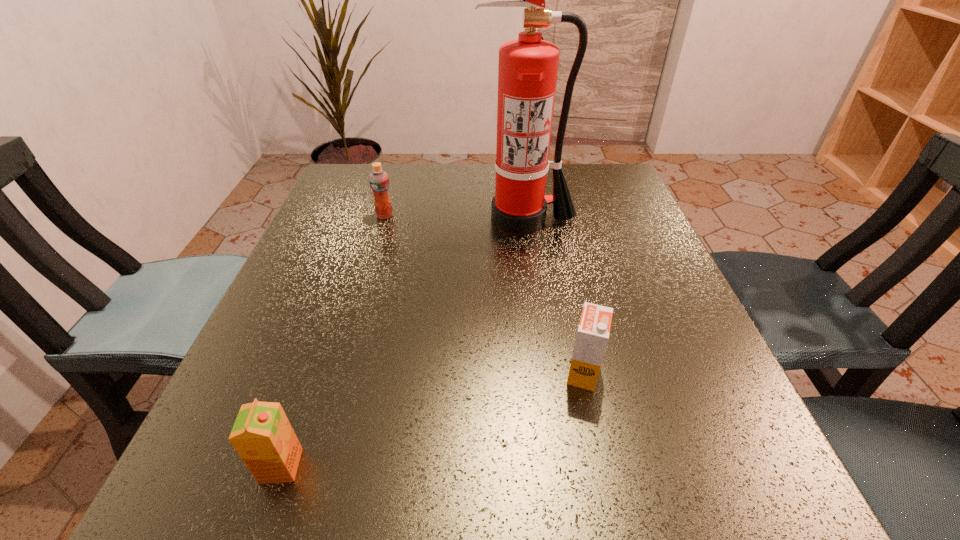
This screenshot has height=540, width=960. Find the location of `fire extinguisher`. fire extinguisher is located at coordinates (527, 71).

The height and width of the screenshot is (540, 960). I want to click on the farthest orange juice, so click(x=379, y=181).

At what (x,y) coordinates should I click in order to perform the action: click on the third farthest object. Please return your answer as a coordinate pair (x, y). The width and height of the screenshot is (960, 540). Looking at the image, I should click on (593, 332).

The width and height of the screenshot is (960, 540). Find the location of `the second nearest orange juice`. the second nearest orange juice is located at coordinates (593, 332).

Where is `the nearest object`? The image size is (960, 540). the nearest object is located at coordinates (262, 435).

Identify the location of vacant space located 0.350m at the nozzle of the fire extinguisher. (541, 367).

At what (x,y) coordinates should I click in order to perform the action: click on vacant point located 0.150m on the front of the farthest orange juice. Please return your answer as a coordinate pair (x, y). This screenshot has width=960, height=540. Looking at the image, I should click on (371, 263).

You are a GUI agent. You are given a task and a screenshot of the screen. Output one action in this format:
    pyautogui.click(x=<x>, y=<y>)
    Task: Click on the vacant region located 0.120m on the right of the second farthest orange juice
    The image size is (960, 540).
    Given the screenshot: What is the action you would take?
    pyautogui.click(x=680, y=373)

Locate an element on the screen. The height and width of the screenshot is (540, 960). vacant space located 0.060m on the right of the nearest object is located at coordinates (347, 466).

What are the coordinates of `fire extinguisher present at the far edge` in the screenshot? It's located at (527, 71).